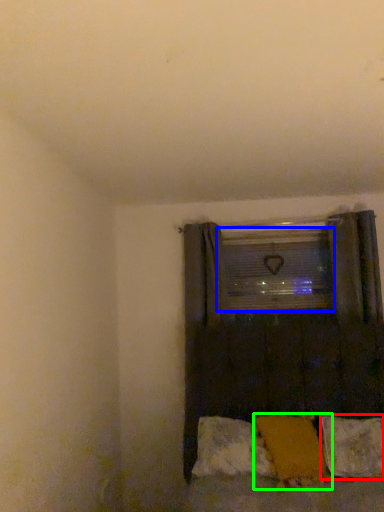
Question: Which is farther away from pillow (highlighted by a red box)? window screen (highlighted by a blue box) or pillow (highlighted by a green box)?

Choices:
 (A) window screen
 (B) pillow

Answer: (A)